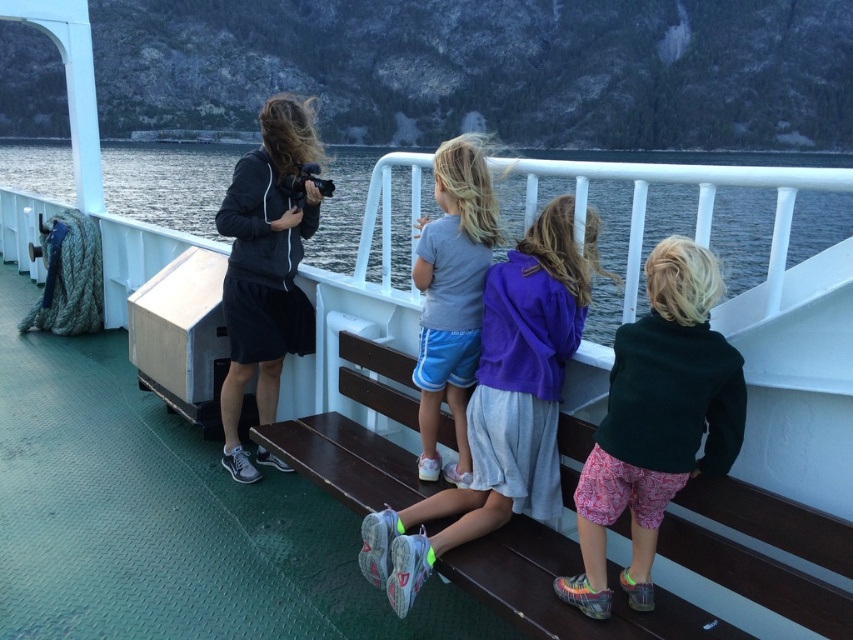
You are standing on the ferry deck and want to find the gray fabric shorts at center. According to the coordinates provided, in which direction should you look relative to the wooden bench?

The gray fabric shorts at center is located at coordinates point (502, 404). Since the bench is in the foreground, you should look towards the center of the bench to find the gray fabric shorts at center.

Consider the image. You are a photographer trying to capture a candid shot of the children on the ferry. You notice the light gray cotton shirt at center and the matte black jacket at center. Which child should you focus on to ensure the subject is not obscured by the other?

The light gray cotton shirt at center is behind the matte black jacket at center, so focusing on the matte black jacket at center will ensure it is not obscured.